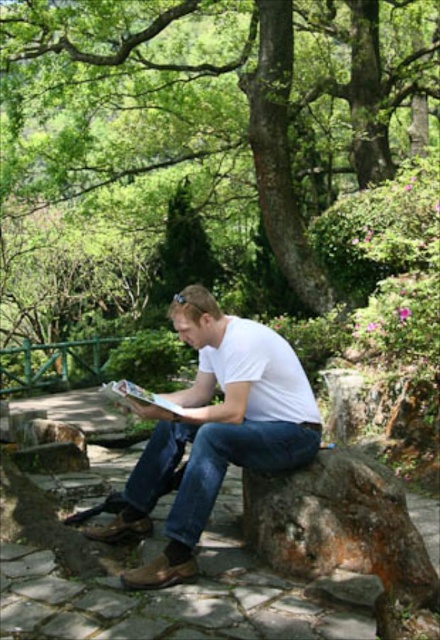
Question: Does green leafy tree at center lie behind white matte t-shirt at center?

Choices:
 (A) yes
 (B) no

Answer: (A)

Question: Considering the real-world distances, which object is closest to the green leafy tree at center?

Choices:
 (A) white matte t-shirt at center
 (B) blue denim jeans at center
 (C) white cotton shirt at center

Answer: (B)

Question: Among these points, which one is nearest to the camera?

Choices:
 (A) (191, 461)
 (B) (278, 401)
 (C) (308, 435)

Answer: (A)

Question: Is blue denim jeans at center smaller than white matte t-shirt at center?

Choices:
 (A) yes
 (B) no

Answer: (B)

Question: From the image, what is the correct spatial relationship of green leafy tree at center in relation to white cotton shirt at center?

Choices:
 (A) left
 (B) right

Answer: (A)

Question: Which point appears closest to the camera in this image?

Choices:
 (A) (147, 490)
 (B) (190, 125)
 (C) (234, 333)

Answer: (C)